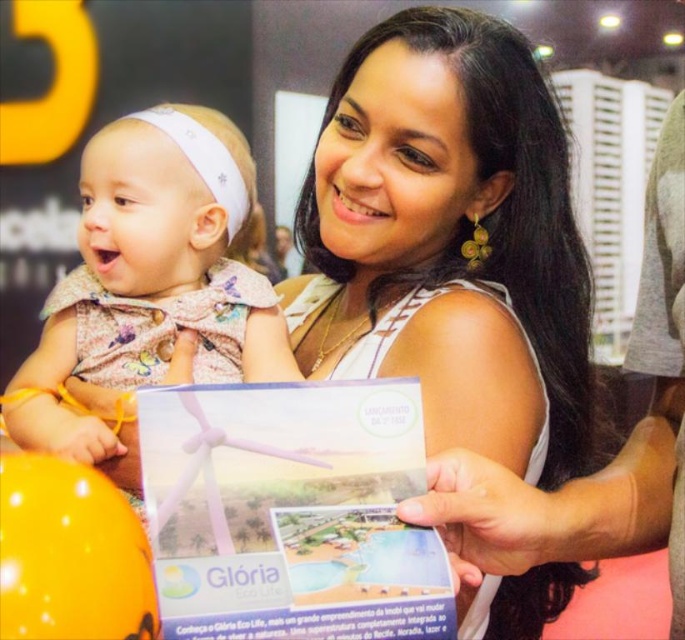
You are a photographer at the event and need to capture a closeup shot of both the matte white brochure at center and the matte pink dress at center. Can you fit both into the frame if your camera has a minimum focus distance of 38 centimeters?

The matte white brochure at center and the matte pink dress at center are 38.96 centimeters apart. Since the distance between them is slightly more than the camera minimum focus distance of 38 centimeters, you might not be able to capture both in focus simultaneously.

You are standing at a distance of 1 meter from the point marked as point (475, 243). Can you safely approach this point without moving closer than 1 meter?

The distance between you and point (475, 243) is 92.73 centimeters, which is less than 1 meter. Therefore, you are already closer than the 1 meter requirement, so you cannot safely approach without violating the distance constraint.